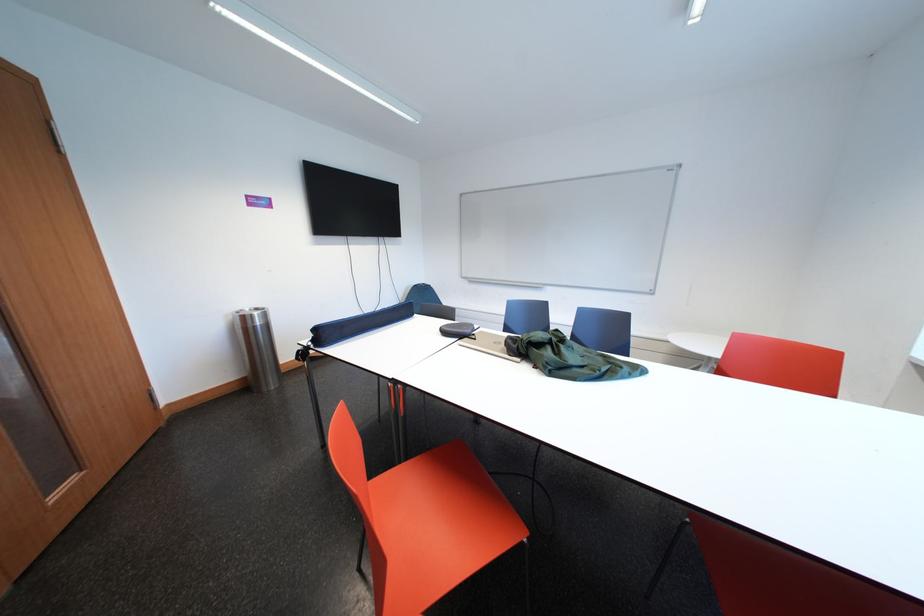
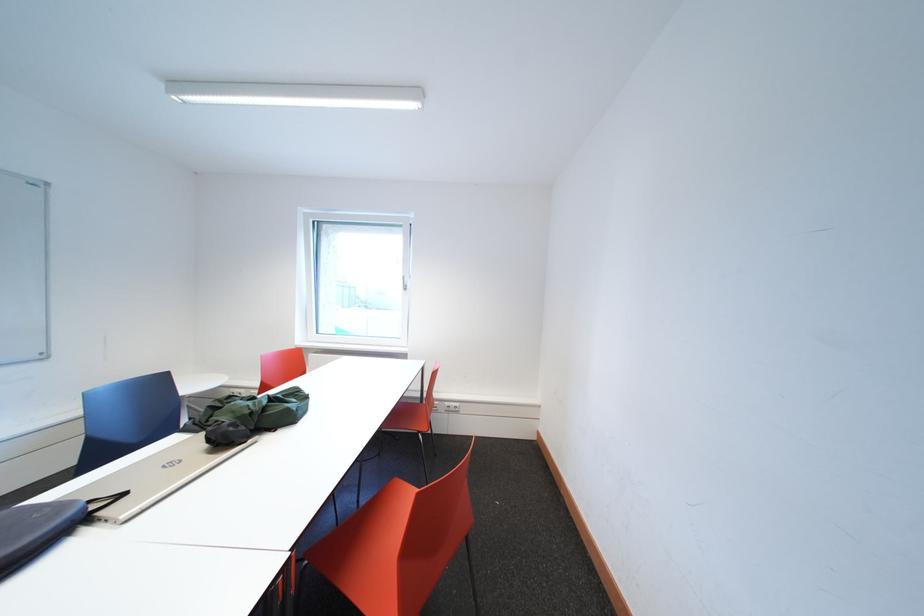
Where in the second image is the point corresponding to (x=531, y=344) from the first image?

(261, 418)